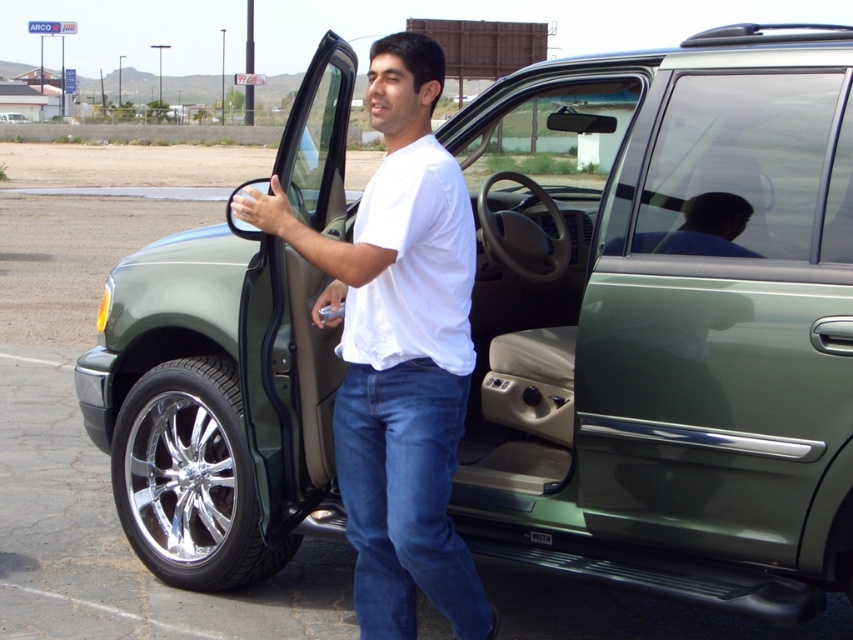
Does white cotton shirt at center lie behind green metallic suv at center?

That is False.

Which of these two, white cotton shirt at center or green metallic suv at center, stands taller?

white cotton shirt at center is taller.

Does point (410, 618) come behind point (4, 115)?

No, (410, 618) is in front of (4, 115).

Identify the location of white cotton shirt at center. The width and height of the screenshot is (853, 640). (398, 349).

Who is higher up, satin green door at lower right or green metallic suv at center?

green metallic suv at center is higher up.

Describe the element at coordinates (720, 312) in the screenshot. I see `satin green door at lower right` at that location.

Between point (605, 284) and point (15, 122), which one is positioned behind?

The point (15, 122) is behind.

You are a GUI agent. You are given a task and a screenshot of the screen. Output one action in this format:
    pyautogui.click(x=<x>, y=<y>)
    Task: Click on the satin green door at lower right
    
    Given the screenshot: What is the action you would take?
    pyautogui.click(x=720, y=312)

Who is positioned more to the right, satin green door at lower right or white cotton shirt at center?

Positioned to the right is satin green door at lower right.

Between point (780, 346) and point (465, 611), which one is positioned behind?

The point (465, 611) is more distant.

Where is `satin green door at lower right`? The width and height of the screenshot is (853, 640). satin green door at lower right is located at coordinates (720, 312).